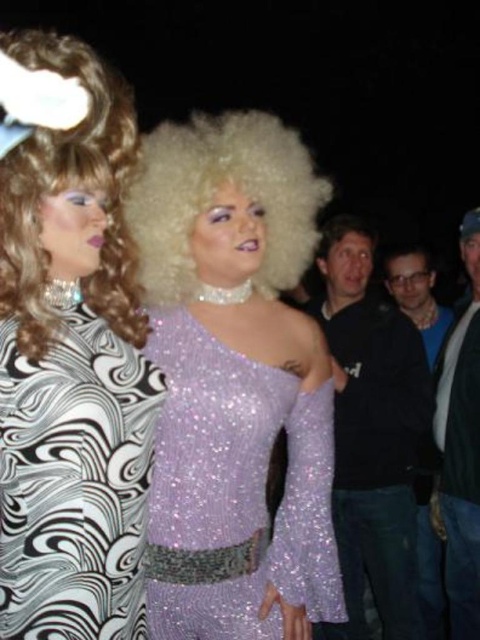
Does black and white patterned dress at left appear on the left side of denim jacket at right?

Yes, black and white patterned dress at left is to the left of denim jacket at right.

Which of these two, black and white patterned dress at left or denim jacket at right, stands shorter?

Standing shorter between the two is black and white patterned dress at left.

Is point (107, 570) more distant than point (452, 592)?

No, it is not.

Where is `black and white patterned dress at left`? The height and width of the screenshot is (640, 480). black and white patterned dress at left is located at coordinates (70, 352).

Measure the distance between dark blue shirt at right and shiny blonde wig at center.

The distance of dark blue shirt at right from shiny blonde wig at center is 3.96 feet.

Who is taller, dark blue shirt at right or shiny blonde wig at center?

dark blue shirt at right is taller.

Where is `dark blue shirt at right`? Image resolution: width=480 pixels, height=640 pixels. dark blue shirt at right is located at coordinates (373, 442).

Where is `dark blue shirt at right`? dark blue shirt at right is located at coordinates (373, 442).

Is point (421, 358) positioned behind point (429, 454)?

No.

Is dark blue shirt at right taller than dark blue sweater at right?

Yes, dark blue shirt at right is taller than dark blue sweater at right.

The width and height of the screenshot is (480, 640). Find the location of `dark blue shirt at right`. dark blue shirt at right is located at coordinates (373, 442).